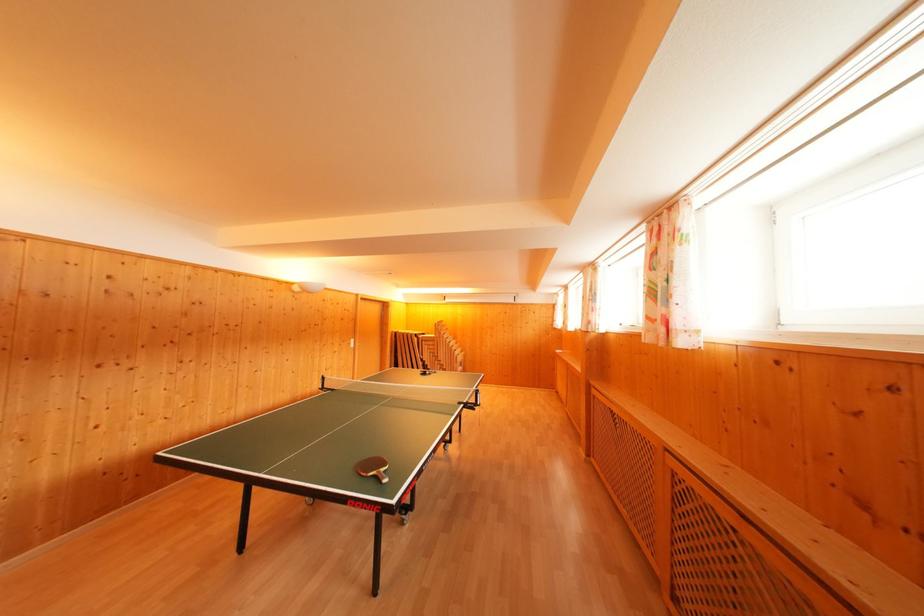
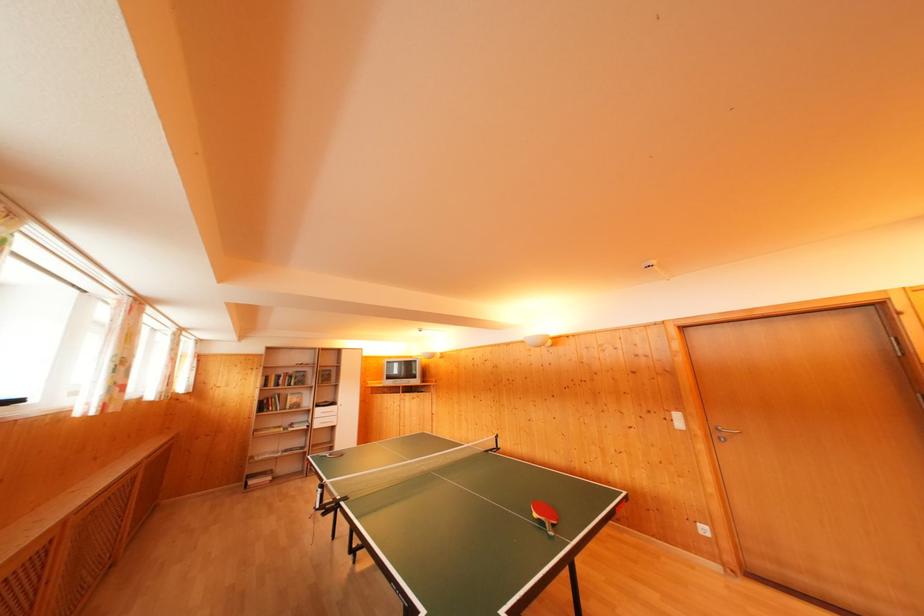
Where in the second image is the point corresponding to (358,346) from the first image?

(682, 421)